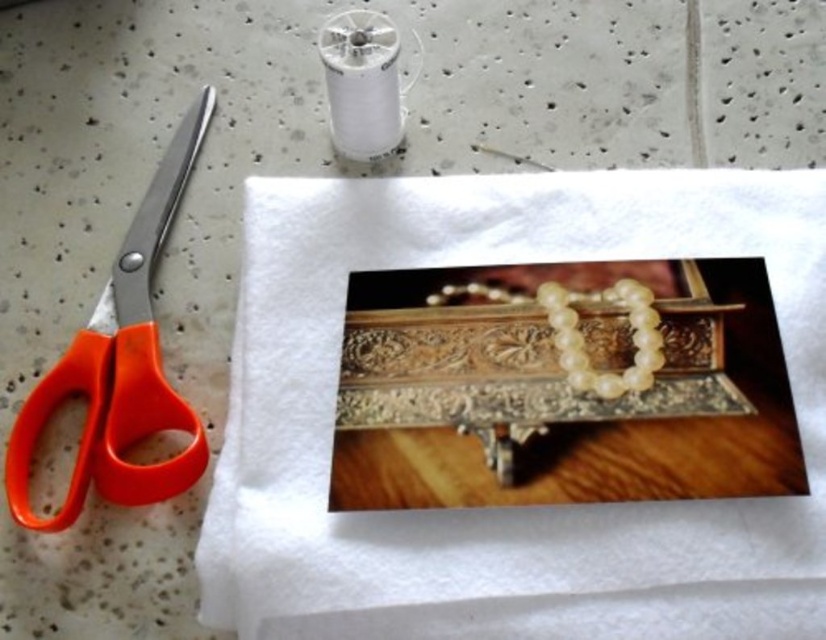
Based on the provided scene description, what are the coordinates of the white fabric at center?

The white fabric at center is located at coordinates (x=501, y=508).

You are trying to determine if the white fabric at center can cover the orange plastic scissors at left completely. Based on their sizes, what do you think?

The white fabric at center is bigger than the orange plastic scissors at left, so it can cover them completely.